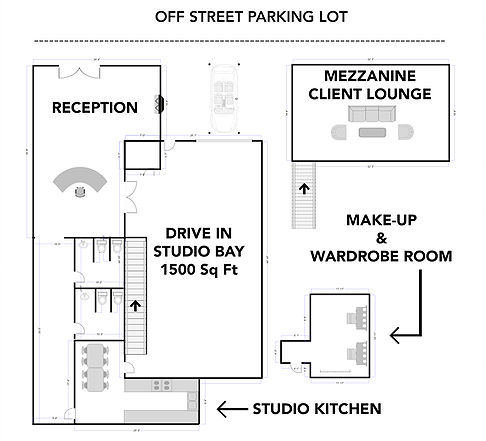
This screenshot has width=486, height=441. I want to click on sink, so click(x=194, y=398), click(x=197, y=405).